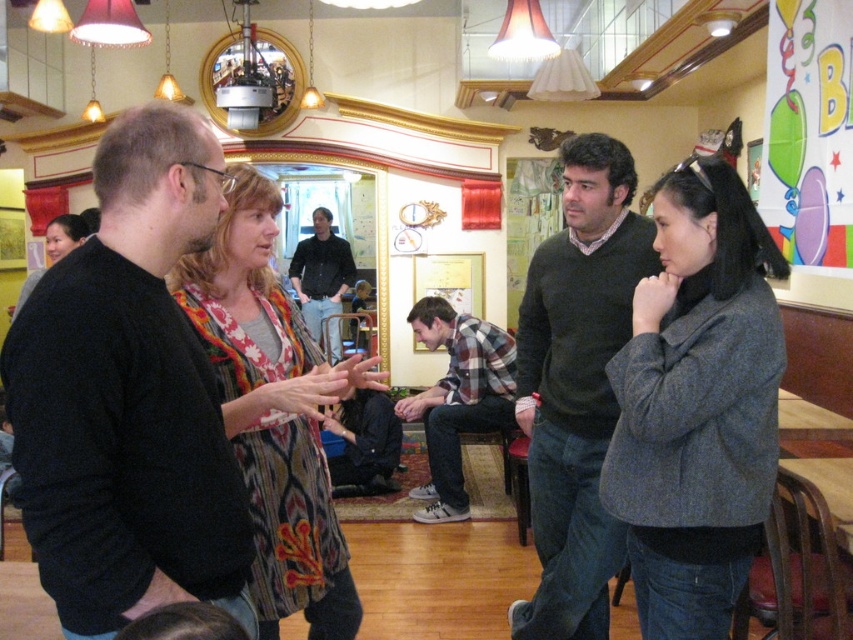
Based on the photo, which of these two, black matte sweater at left or dark blue jeans at center, stands taller?

dark blue jeans at center

Is point (151, 552) closer to camera compared to point (335, 269)?

That is True.

This screenshot has width=853, height=640. What do you see at coordinates (128, 397) in the screenshot?
I see `black matte sweater at left` at bounding box center [128, 397].

The height and width of the screenshot is (640, 853). Identify the location of black matte sweater at left. (128, 397).

Is dark gray sweater at center positioned before multicolored woven scarf at center?

No, it is not.

Which is behind, point (592, 573) or point (318, 397)?

Point (592, 573)

What do you see at coordinates (576, 385) in the screenshot?
I see `dark gray sweater at center` at bounding box center [576, 385].

I want to click on dark gray sweater at center, so click(x=576, y=385).

Between point (532, 474) and point (303, 243), which one is positioned in front?

Point (532, 474) is more forward.

Does dark gray sweater at center appear on the left side of dark blue jeans at center?

No, dark gray sweater at center is not to the left of dark blue jeans at center.

What do you see at coordinates (576, 385) in the screenshot? The width and height of the screenshot is (853, 640). I see `dark gray sweater at center` at bounding box center [576, 385].

Locate an element on the screen. Image resolution: width=853 pixels, height=640 pixels. dark gray sweater at center is located at coordinates (576, 385).